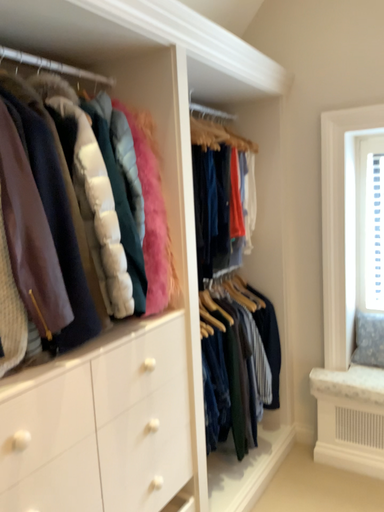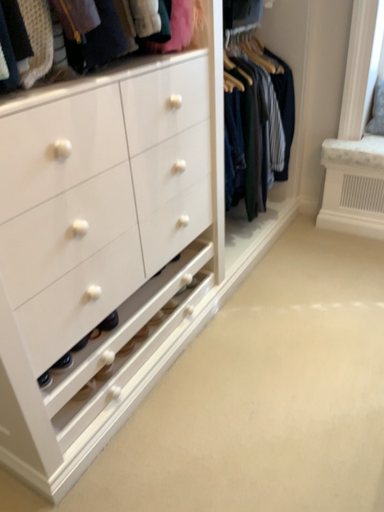
Question: Which way did the camera rotate in the video?

Choices:
 (A) rotated downward
 (B) rotated upward

Answer: (A)